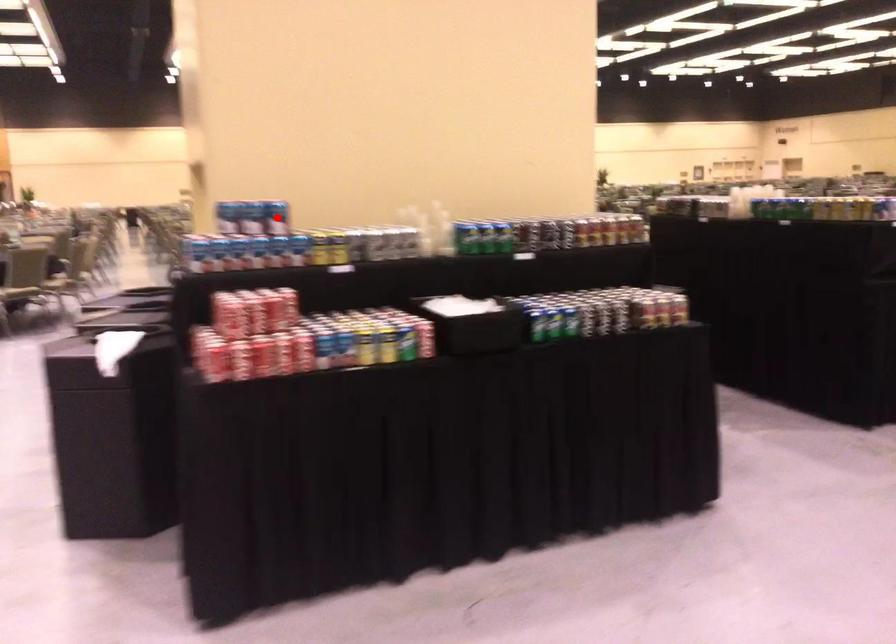
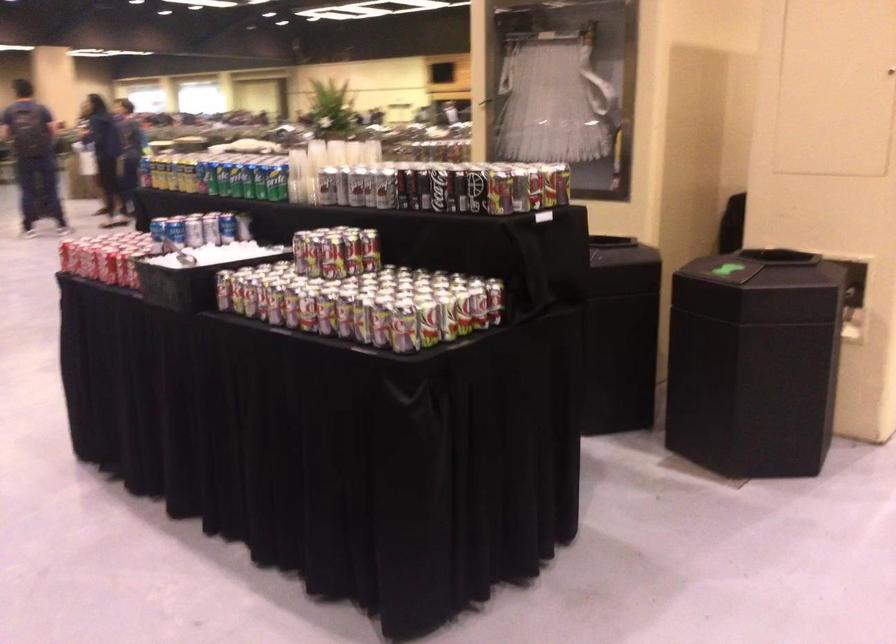
Question: I am providing you with two images of the same scene from different viewpoints. A red point is marked on the first image. Is the red point's position out of view in image 2?

Choices:
 (A) Yes
 (B) No

Answer: (A)